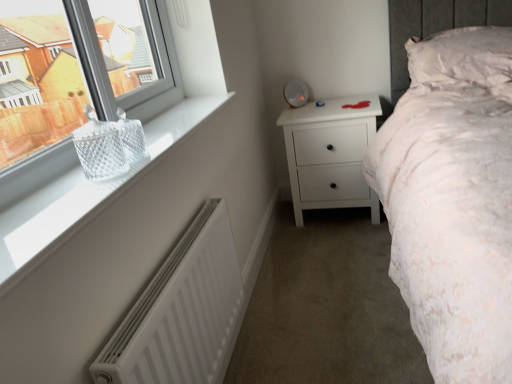
Describe the element at coordinates (330, 154) in the screenshot. This screenshot has width=512, height=384. I see `white matte chest of drawers at center` at that location.

You are a GUI agent. You are given a task and a screenshot of the screen. Output one action in this format:
    pyautogui.click(x=<x>, y=<y>)
    Task: Click on the clear glass basket at left, which appears as the 1th window when ordered from the bottom
    The height and width of the screenshot is (384, 512).
    Given the screenshot: What is the action you would take?
    pyautogui.click(x=120, y=176)

Describe the element at coordinates (464, 59) in the screenshot. The height and width of the screenshot is (384, 512). I see `white textured pillow at upper right` at that location.

At what (x,y) coordinates should I click in order to perform the action: click on white textured pillow at upper right. Please return your answer as a coordinate pair (x, y). Looking at the image, I should click on (464, 59).

Describe the element at coordinates (38, 85) in the screenshot. I see `clear glass basket at upper left, the 1th window from the top` at that location.

Locate an element on the screen. The image size is (512, 384). white matte chest of drawers at center is located at coordinates (330, 154).

In the scene shown: Relative to clear glass basket at upper left, the 1th window from the top, is white matte radiator at lower left in front or behind?

white matte radiator at lower left is behind clear glass basket at upper left, the 1th window from the top.

How much distance is there between white matte radiator at lower left and clear glass basket at upper left, the 1th window from the top?

The distance of white matte radiator at lower left from clear glass basket at upper left, the 1th window from the top, is 28.56 inches.

Is white matte radiator at lower left facing away from clear glass basket at upper left, which is the second window in bottom-to-top order?

No.

Considering the sizes of objects white matte radiator at lower left and clear glass basket at upper left, which is the second window in bottom-to-top order, in the image provided, who is thinner, white matte radiator at lower left or clear glass basket at upper left, which is the second window in bottom-to-top order,?

white matte radiator at lower left is thinner.

Would you say white matte radiator at lower left is a long distance from white matte chest of drawers at center?

Yes, white matte radiator at lower left and white matte chest of drawers at center are located far from each other.

Looking at this image, does white matte radiator at lower left have a lesser width compared to white matte chest of drawers at center?

Indeed, white matte radiator at lower left has a lesser width compared to white matte chest of drawers at center.

Who is smaller, white matte radiator at lower left or white matte chest of drawers at center?

white matte radiator at lower left.

The width and height of the screenshot is (512, 384). Identify the location of chest of drawers that appears on the right of white matte radiator at lower left. (330, 154).

Is white matte radiator at lower left facing away from white textured pillow at upper right?

No, white textured pillow at upper right is not at the back of white matte radiator at lower left.

From the picture: Does white matte radiator at lower left have a lesser height compared to white textured pillow at upper right?

Incorrect, the height of white matte radiator at lower left does not fall short of that of white textured pillow at upper right.

Locate an element on the screen. Image resolution: width=512 pixels, height=384 pixels. radiator below the white textured pillow at upper right (from the image's perspective) is located at coordinates (181, 312).

Identify the location of pillow on the right of white matte chest of drawers at center. The image size is (512, 384). (464, 59).

Is white textured pillow at upper right not inside white matte chest of drawers at center?

Yes, white textured pillow at upper right is outside of white matte chest of drawers at center.

Based on the photo, from the image's perspective, is white textured pillow at upper right over white matte chest of drawers at center?

Yes, from the image's perspective, white textured pillow at upper right is above white matte chest of drawers at center.

Considering the relative positions of clear glass basket at left, which appears as the 1th window when ordered from the bottom, and white textured pillow at upper right in the image provided, is clear glass basket at left, which appears as the 1th window when ordered from the bottom, to the left of white textured pillow at upper right from the viewer's perspective?

Yes.

Is the depth of clear glass basket at left, which appears as the 1th window when ordered from the bottom, greater than that of white textured pillow at upper right?

No.

Is clear glass basket at left, which appears as the 1th window when ordered from the bottom, bigger or smaller than white textured pillow at upper right?

→ Considering their sizes, clear glass basket at left, which appears as the 1th window when ordered from the bottom, takes up less space than white textured pillow at upper right.

Between clear glass basket at left, which appears as the 1th window when ordered from the bottom, and white textured pillow at upper right, which one has larger width?

Wider between the two is white textured pillow at upper right.

From the image's perspective, is white textured pillow at upper right positioned above or below white matte radiator at lower left?

Based on their image positions, white textured pillow at upper right is located above white matte radiator at lower left.

From the picture: From a real-world perspective, is white textured pillow at upper right positioned above or below white matte radiator at lower left?

In terms of real-world spatial position, white textured pillow at upper right is above white matte radiator at lower left.

Who is shorter, white textured pillow at upper right or white matte radiator at lower left?

white textured pillow at upper right is shorter.

Between white textured pillow at upper right and white matte radiator at lower left, which one has larger width?

Wider between the two is white textured pillow at upper right.

How many degrees apart are the facing directions of white matte chest of drawers at center and white textured pillow at upper right?

There is a 0.682-degree angle between the facing directions of white matte chest of drawers at center and white textured pillow at upper right.

Is the position of white matte chest of drawers at center more distant than that of white textured pillow at upper right?

Yes, white matte chest of drawers at center is further from the viewer.

From the picture: Is white matte chest of drawers at center located outside white textured pillow at upper right?

Yes.

Consider the image. Considering the sizes of objects white matte chest of drawers at center and white textured pillow at upper right in the image provided, who is wider, white matte chest of drawers at center or white textured pillow at upper right?

With larger width is white textured pillow at upper right.

I want to click on radiator below the clear glass basket at upper left, the 1th window from the top (from the image's perspective), so click(181, 312).

Image resolution: width=512 pixels, height=384 pixels. Find the location of `chest of drawers below the white matte radiator at lower left (from a real-world perspective)`. chest of drawers below the white matte radiator at lower left (from a real-world perspective) is located at coordinates (330, 154).

Based on their spatial positions, is clear glass basket at left, which appears as the 1th window when ordered from the bottom, or white matte radiator at lower left further from clear glass basket at upper left, the 1th window from the top?

white matte radiator at lower left is further to clear glass basket at upper left, the 1th window from the top.

Estimate the real-world distances between objects in this image. Which object is closer to white matte radiator at lower left, clear glass basket at upper left, which is the second window in bottom-to-top order, or clear glass basket at left, which is the second window from top to bottom?

The object closer to white matte radiator at lower left is clear glass basket at left, which is the second window from top to bottom.

Based on their spatial positions, is white matte chest of drawers at center or clear glass basket at left, which appears as the 1th window when ordered from the bottom, closer to white textured pillow at upper right?

white matte chest of drawers at center is positioned closer to the anchor white textured pillow at upper right.

From the image, which object appears to be nearer to white matte chest of drawers at center, clear glass basket at upper left, which is the second window in bottom-to-top order, or white textured pillow at upper right?

white textured pillow at upper right lies closer to white matte chest of drawers at center than the other object.

In the scene shown: When comparing their distances from white matte radiator at lower left, does clear glass basket at upper left, the 1th window from the top, or white textured pillow at upper right seem closer?

clear glass basket at upper left, the 1th window from the top, lies closer to white matte radiator at lower left than the other object.

Considering their positions, is clear glass basket at left, which is the second window from top to bottom, positioned closer to white matte radiator at lower left than white matte chest of drawers at center?

clear glass basket at left, which is the second window from top to bottom, is closer to white matte radiator at lower left.

From the image, which object appears to be farther from white matte chest of drawers at center, white matte radiator at lower left or white textured pillow at upper right?

The object further to white matte chest of drawers at center is white matte radiator at lower left.

Considering their positions, is white textured pillow at upper right positioned closer to clear glass basket at left, which appears as the 1th window when ordered from the bottom, than white matte radiator at lower left?

Based on the image, white matte radiator at lower left appears to be nearer to clear glass basket at left, which appears as the 1th window when ordered from the bottom.

The image size is (512, 384). In order to click on radiator between clear glass basket at left, which appears as the 1th window when ordered from the bottom, and white textured pillow at upper right from left to right in this screenshot , I will do `click(181, 312)`.

Where is `window between clear glass basket at left, which appears as the 1th window when ordered from the bottom, and white matte chest of drawers at center, along the z-axis`? This screenshot has height=384, width=512. window between clear glass basket at left, which appears as the 1th window when ordered from the bottom, and white matte chest of drawers at center, along the z-axis is located at coordinates (38, 85).

Find the location of a particular element. The width and height of the screenshot is (512, 384). pillow positioned between clear glass basket at left, which is the second window from top to bottom, and white matte chest of drawers at center from near to far is located at coordinates [x=464, y=59].

Where is `window that lies between clear glass basket at upper left, the 1th window from the top, and white matte radiator at lower left from top to bottom`? This screenshot has height=384, width=512. window that lies between clear glass basket at upper left, the 1th window from the top, and white matte radiator at lower left from top to bottom is located at coordinates (120, 176).